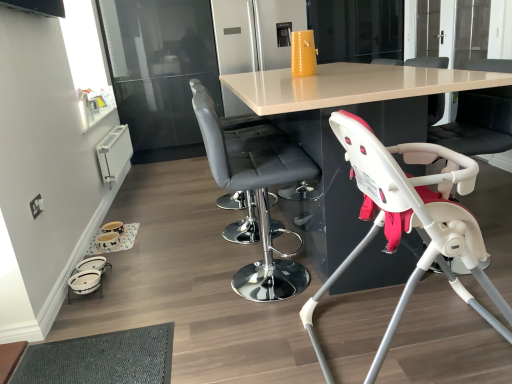
Locate an element on the screen. vacant space in front of matte gray bar stool at center, placed as the 1th chair when sorted from left to right is located at coordinates (223, 257).